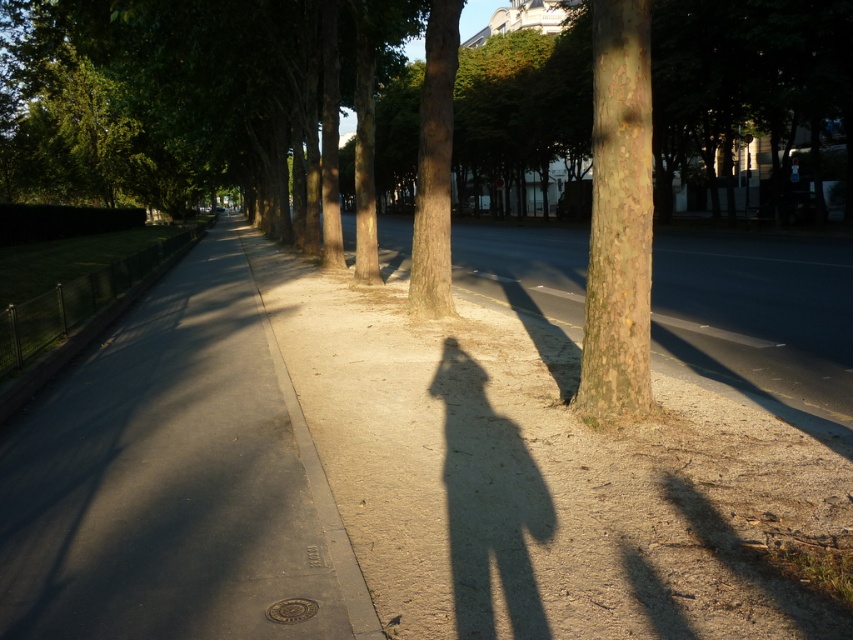
Between dark asphalt pavement at center and smooth brown bark at center, which one is positioned lower?

dark asphalt pavement at center is below.

What do you see at coordinates (173, 481) in the screenshot?
I see `dark asphalt pavement at center` at bounding box center [173, 481].

Image resolution: width=853 pixels, height=640 pixels. What do you see at coordinates (173, 481) in the screenshot? I see `dark asphalt pavement at center` at bounding box center [173, 481].

At what (x,y) coordinates should I click in order to perform the action: click on dark asphalt pavement at center. Please return your answer as a coordinate pair (x, y). Looking at the image, I should click on (173, 481).

Between brown dirt sidewalk at center and brown rough tree trunk at center, which one is positioned lower?

brown dirt sidewalk at center is lower down.

Is brown dirt sidewalk at center further to camera compared to brown rough tree trunk at center?

No, it is in front of brown rough tree trunk at center.

Is point (770, 579) closer to camera compared to point (369, 112)?

That is True.

Image resolution: width=853 pixels, height=640 pixels. Find the location of `brown dirt sidewalk at center`. brown dirt sidewalk at center is located at coordinates (543, 477).

Can you confirm if smooth brown bark at center is thinner than brown rough bark tree trunk at center?

Yes.

Can you confirm if smooth brown bark at center is smaller than brown rough bark tree trunk at center?

Correct, smooth brown bark at center occupies less space than brown rough bark tree trunk at center.

Locate an element on the screen. This screenshot has width=853, height=640. smooth brown bark at center is located at coordinates (618, 218).